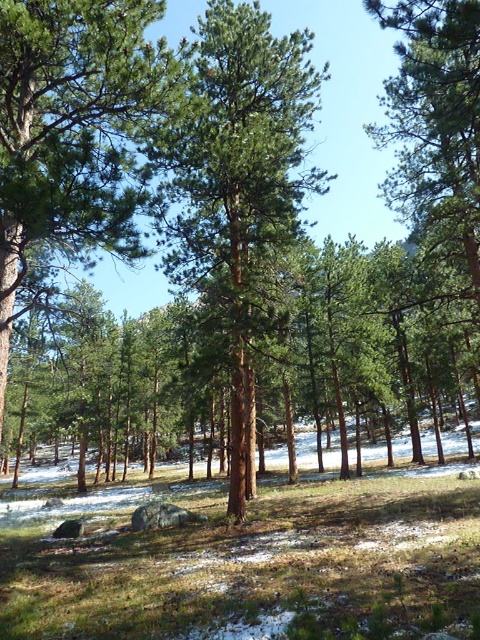
Question: Does green rough bark tree at center come behind green matte tree at center?

Choices:
 (A) no
 (B) yes

Answer: (A)

Question: Is green rough bark tree at center closer to camera compared to green matte tree at center?

Choices:
 (A) no
 (B) yes

Answer: (B)

Question: Which of the following is the closest to the observer?

Choices:
 (A) green rough bark tree at center
 (B) green matte tree at center

Answer: (A)

Question: Can you confirm if green rough bark tree at center is smaller than green matte tree at center?

Choices:
 (A) no
 (B) yes

Answer: (B)